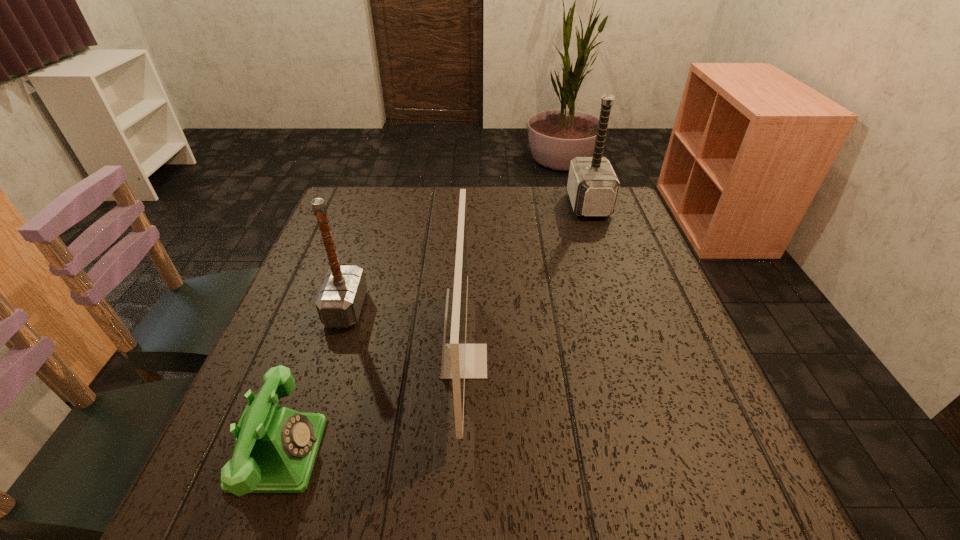
At what (x,y) coordinates should I click in order to perform the action: click on the rightmost object. Please return your answer as a coordinate pair (x, y). Looking at the image, I should click on (593, 186).

The width and height of the screenshot is (960, 540). Find the location of `the farthest object`. the farthest object is located at coordinates point(593,186).

Where is `the shorter hammer`? The width and height of the screenshot is (960, 540). the shorter hammer is located at coordinates (339, 302).

Identify the location of the left hammer. (339, 302).

The width and height of the screenshot is (960, 540). I want to click on monitor, so [x=460, y=361].

Identify the location of the shortest object. (275, 448).

At what (x,y) coordinates should I click in order to perform the action: click on vacant area situated 0.080m for striking with the head of the farther hammer. Please return your answer as a coordinate pair (x, y). This screenshot has width=960, height=540. Looking at the image, I should click on (543, 205).

Find the location of a particular element. vacant area situated 0.120m for striking with the head of the farther hammer is located at coordinates (530, 205).

Where is `free space located for striking with the head of the farther hammer`? This screenshot has width=960, height=540. free space located for striking with the head of the farther hammer is located at coordinates (523, 205).

The width and height of the screenshot is (960, 540). Identify the location of vacant space located on the striking surface of the nearer hammer. (504, 308).